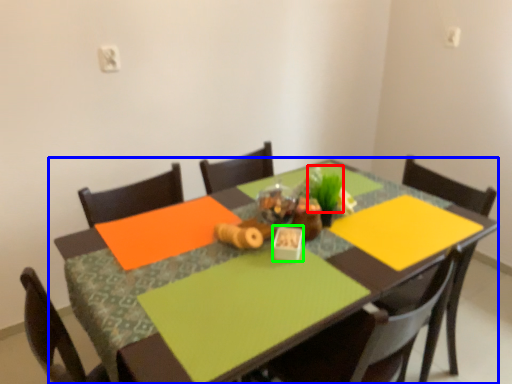
Question: Based on their relative distances, which object is nearer to plant (highlighted by a red box)? Choose from table (highlighted by a blue box) and tableware (highlighted by a green box).

Choices:
 (A) table
 (B) tableware

Answer: (B)